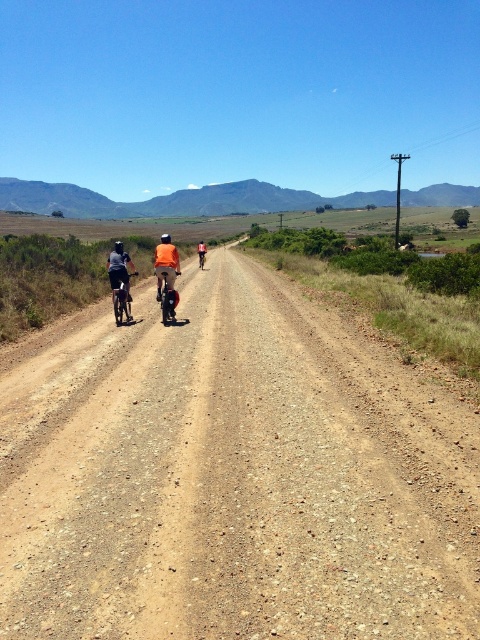
Question: Which point is farther to the camera?

Choices:
 (A) (115, 320)
 (B) (10, 400)
 (C) (162, 284)

Answer: (A)

Question: In this image, where is orange fabric jacket at center located relative to shiny metallic bicycle at center?

Choices:
 (A) right
 (B) left

Answer: (B)

Question: Which point is closer to the camera?

Choices:
 (A) (166, 260)
 (B) (160, 269)
 (C) (268, 422)
 (D) (120, 284)

Answer: (C)

Question: Which of the following is the farthest from the observer?

Choices:
 (A) (154, 264)
 (B) (115, 316)
 (C) (168, 288)

Answer: (A)

Question: Is orange fabric jacket at center below matte black bicycle at left?

Choices:
 (A) yes
 (B) no

Answer: (B)

Question: Is brown gravel road at center above orange fabric jacket at center?

Choices:
 (A) no
 (B) yes

Answer: (A)